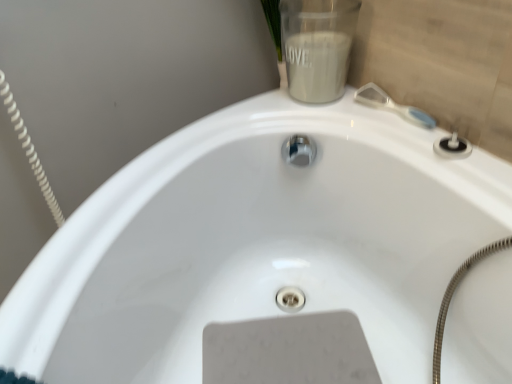
Question: Is clear plastic brush at upper right bigger or smaller than matte white jar at upper right?

Choices:
 (A) big
 (B) small

Answer: (B)

Question: In terms of height, does clear plastic brush at upper right look taller or shorter compared to matte white jar at upper right?

Choices:
 (A) tall
 (B) short

Answer: (B)

Question: Is point (368, 102) positioned closer to the camera than point (287, 77)?

Choices:
 (A) farther
 (B) closer

Answer: (B)

Question: Considering the relative positions of matte white jar at upper right and clear plastic brush at upper right in the image provided, is matte white jar at upper right to the left or to the right of clear plastic brush at upper right?

Choices:
 (A) right
 (B) left

Answer: (B)

Question: Looking at their shapes, would you say matte white jar at upper right is wider or thinner than clear plastic brush at upper right?

Choices:
 (A) thin
 (B) wide

Answer: (B)

Question: Is matte white jar at upper right spatially inside clear plastic brush at upper right, or outside of it?

Choices:
 (A) inside
 (B) outside

Answer: (B)

Question: From the image's perspective, is matte white jar at upper right positioned above or below clear plastic brush at upper right?

Choices:
 (A) below
 (B) above

Answer: (B)